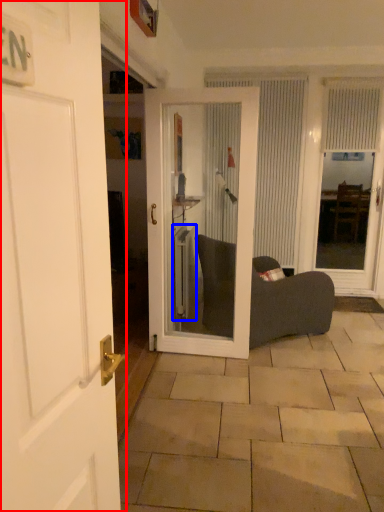
Question: Which of the following is the farthest to the observer, door (highlighted by a red box) or radiator (highlighted by a blue box)?

Choices:
 (A) door
 (B) radiator

Answer: (B)